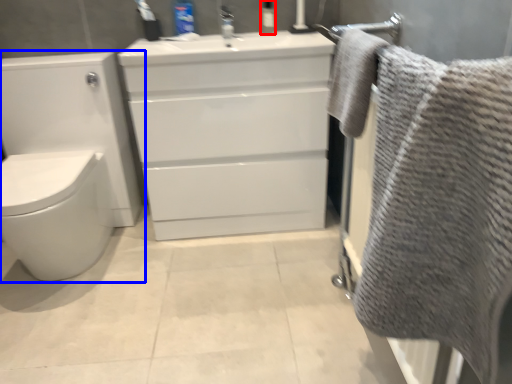
Question: Which of the following is the farthest to the observer, toiletry (highlighted by a red box) or toilet (highlighted by a blue box)?

Choices:
 (A) toiletry
 (B) toilet

Answer: (A)